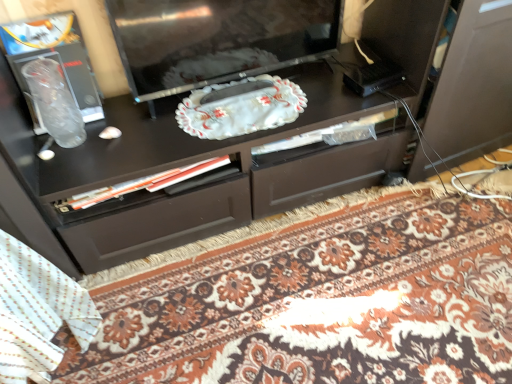
Question: Do you think white textured blanket at lower left is within glossy black television at center, or outside of it?

Choices:
 (A) inside
 (B) outside

Answer: (B)

Question: In the image, is white textured blanket at lower left positioned in front of or behind glossy black television at center?

Choices:
 (A) behind
 (B) front

Answer: (B)

Question: Estimate the real-world distances between objects in this image. Which object is farther from the glossy black television at center?

Choices:
 (A) floral carpet at center
 (B) white textured blanket at lower left

Answer: (B)

Question: Which object is the farthest from the floral carpet at center?

Choices:
 (A) glossy black television at center
 (B) white textured blanket at lower left

Answer: (A)